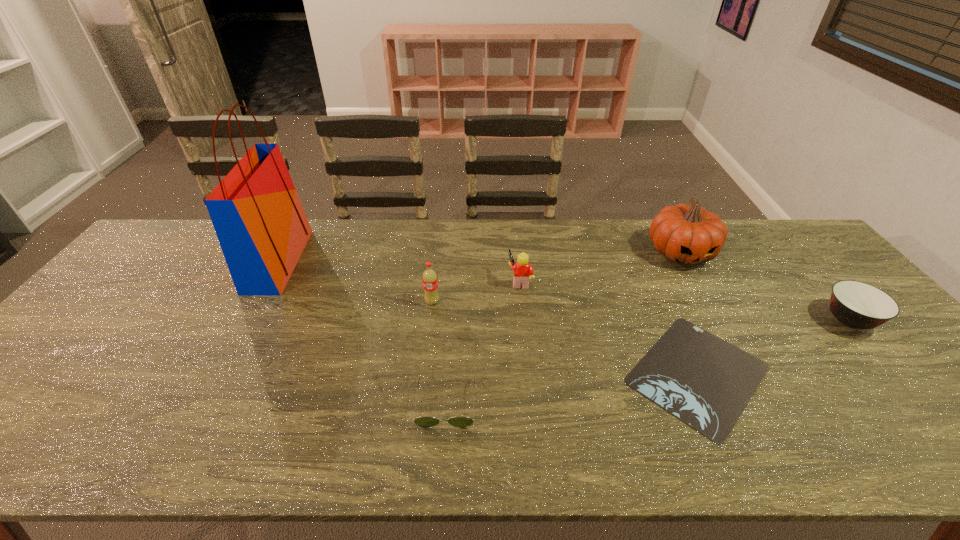
At what (x,y) coordinates should I click in order to perform the action: click on the tallest object. Please return your answer as a coordinate pair (x, y). This screenshot has height=540, width=960. Looking at the image, I should click on (262, 228).

What are the coordinates of `shopping bag` in the screenshot? It's located at (262, 228).

Where is `the sixth shortest object`? This screenshot has width=960, height=540. the sixth shortest object is located at coordinates (687, 234).

Find the location of a particular element. soda is located at coordinates (429, 278).

Where is `the fourth object from right to left`? The width and height of the screenshot is (960, 540). the fourth object from right to left is located at coordinates (523, 271).

In order to click on Lego in this screenshot , I will do `click(523, 271)`.

Locate an element on the screen. the rightmost object is located at coordinates (857, 305).

Where is `soup bowl`? This screenshot has width=960, height=540. soup bowl is located at coordinates (857, 305).

Where is `the sixth tallest object`? the sixth tallest object is located at coordinates (x=424, y=422).

You are a GUI agent. You are given a task and a screenshot of the screen. Output one action in this format:
    pyautogui.click(x=<x>, y=<y>)
    Task: Click on the mousepad
    
    Given the screenshot: What is the action you would take?
    702,380